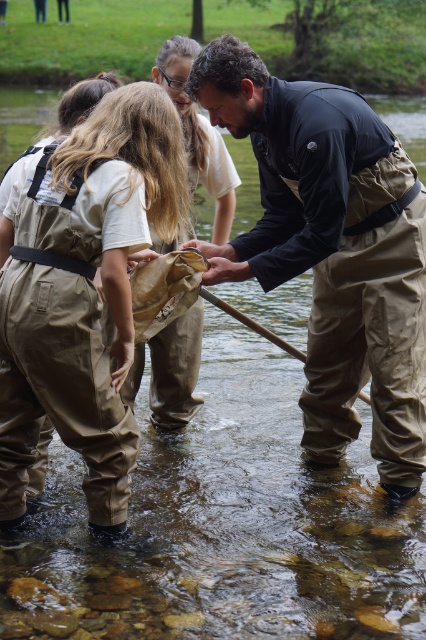
Between point (219, 250) and point (201, 332), which one is positioned in front?

Point (219, 250) is more forward.

Between matte black waders at center and brown suede waders at center, which one is positioned higher?

brown suede waders at center

The height and width of the screenshot is (640, 426). Find the location of `matte black waders at center`. matte black waders at center is located at coordinates (331, 250).

Locate an element on the screen. matte black waders at center is located at coordinates (331, 250).

Who is higher up, matte black waders at center or tan waterproof overalls at center?

matte black waders at center

Between point (356, 148) and point (22, 307), which one is positioned in front?

Point (22, 307) is more forward.

The height and width of the screenshot is (640, 426). I want to click on matte black waders at center, so click(x=331, y=250).

Is tan waterproof overalls at center bigger than brown suede waders at center?

Indeed, tan waterproof overalls at center has a larger size compared to brown suede waders at center.

Is point (164, 236) more distant than point (203, 184)?

No, (164, 236) is closer to viewer.

Where is `tan waterproof overalls at center`? The image size is (426, 640). tan waterproof overalls at center is located at coordinates (83, 292).